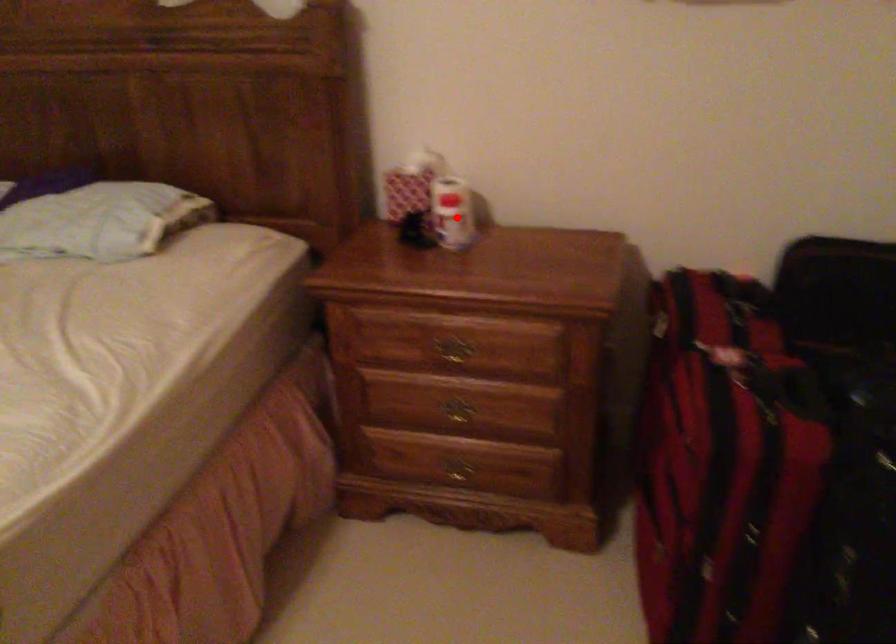
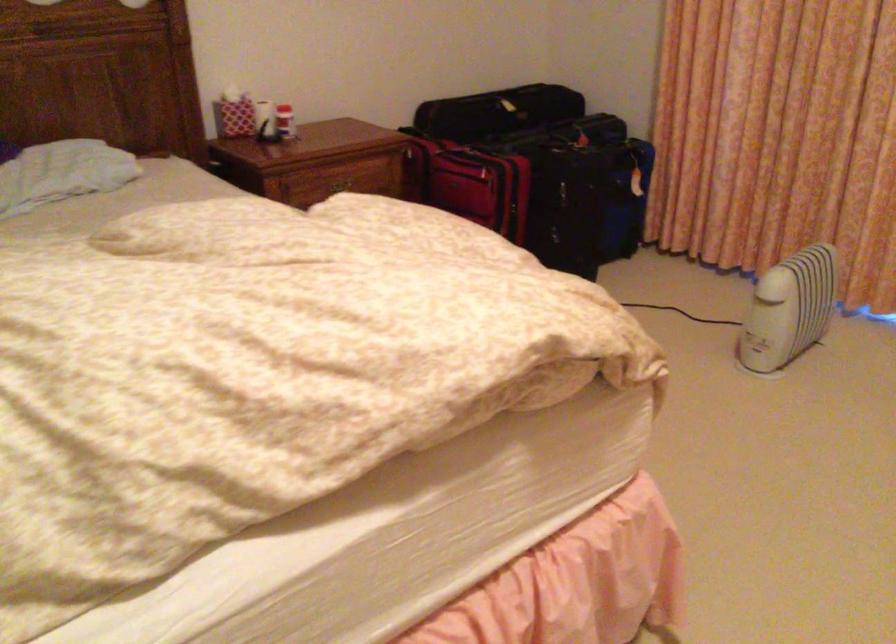
Question: I am providing you with two images of the same scene from different viewpoints. Given a red point in image1, look at the same physical point in image2. Is it:

Choices:
 (A) Closer to the viewpoint
 (B) Farther from the viewpoint

Answer: (B)